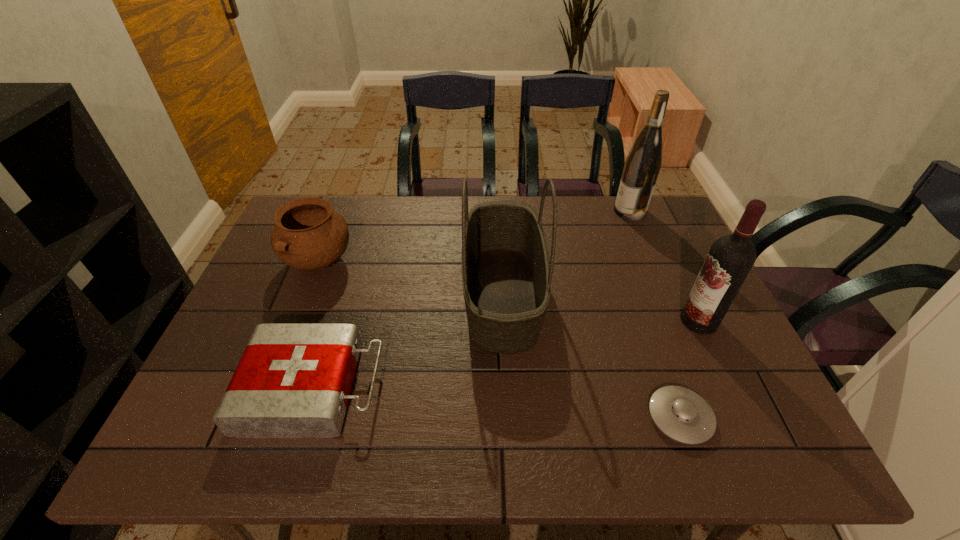
The height and width of the screenshot is (540, 960). What are the coordinates of `object that can be found as the fifth closest to the third shortest object` in the screenshot? It's located at point(731,257).

This screenshot has height=540, width=960. I want to click on free spot that satisfies the following two spatial constraints: 1. on the back side of the farthest object; 2. on the right side of the shortest object, so click(608, 211).

You are a GUI agent. You are given a task and a screenshot of the screen. Output one action in this format:
    pyautogui.click(x=<x>, y=<y>)
    Task: Click on the free space that satisfies the following two spatial constraints: 1. on the front side of the first-aid kit; 2. on the left side of the saucer
    This screenshot has height=540, width=960.
    Given the screenshot: What is the action you would take?
    pyautogui.click(x=304, y=417)

You are a GUI agent. You are given a task and a screenshot of the screen. Output one action in this format:
    pyautogui.click(x=<x>, y=<y>)
    Task: Click on the vacant position in the image that satisfies the following two spatial constraints: 1. on the back side of the shortest object; 2. on the front side of the second shortest object
    
    Given the screenshot: What is the action you would take?
    pyautogui.click(x=669, y=388)

Identify the location of vacant space that satisfies the following two spatial constraints: 1. on the label of the nearer wine bottle; 2. on the front side of the saucer. (744, 417).